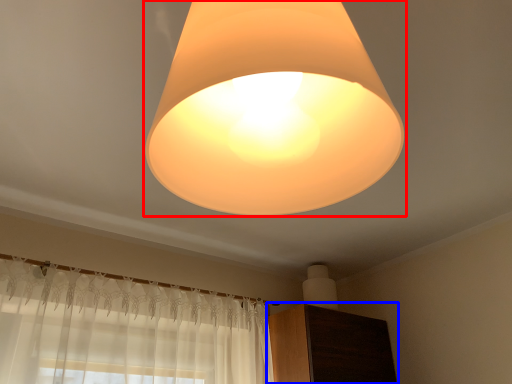
Question: Which object appears farthest to the camera in this image, lamp (highlighted by a red box) or dresser (highlighted by a blue box)?

Choices:
 (A) lamp
 (B) dresser

Answer: (B)